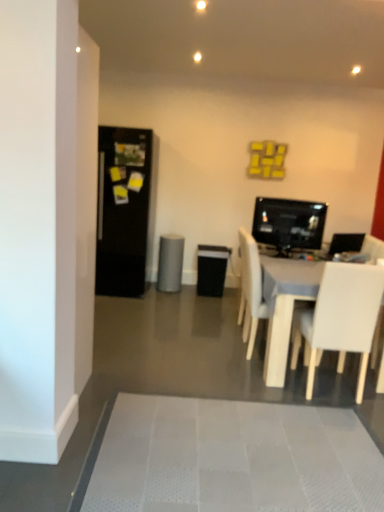
Question: Is gray matte speaker at center wider than white matte chair at center, the second chair viewed from the front?

Choices:
 (A) no
 (B) yes

Answer: (A)

Question: Is gray matte speaker at center not within white matte chair at center, the first chair when ordered from back to front?

Choices:
 (A) yes
 (B) no

Answer: (A)

Question: Is gray matte speaker at center at the right side of white matte chair at center, the second chair viewed from the front?

Choices:
 (A) no
 (B) yes

Answer: (A)

Question: Is the position of gray matte speaker at center less distant than that of white matte chair at center, the second chair viewed from the front?

Choices:
 (A) yes
 (B) no

Answer: (B)

Question: From the image's perspective, is gray matte speaker at center beneath white matte chair at center, the first chair when ordered from back to front?

Choices:
 (A) no
 (B) yes

Answer: (A)

Question: From a real-world perspective, is gray matte speaker at center physically below white matte chair at center, the second chair viewed from the front?

Choices:
 (A) no
 (B) yes

Answer: (B)

Question: Is black matte refrigerator at left behind white textured bath mat at lower center?

Choices:
 (A) yes
 (B) no

Answer: (A)

Question: Does black matte refrigerator at left have a smaller size compared to white textured bath mat at lower center?

Choices:
 (A) yes
 (B) no

Answer: (B)

Question: Does black matte refrigerator at left appear on the right side of white textured bath mat at lower center?

Choices:
 (A) yes
 (B) no

Answer: (B)

Question: Is black matte refrigerator at left directly adjacent to white textured bath mat at lower center?

Choices:
 (A) yes
 (B) no

Answer: (B)

Question: Is black matte refrigerator at left not near white textured bath mat at lower center?

Choices:
 (A) no
 (B) yes

Answer: (B)

Question: Is white textured bath mat at lower center at the back of black matte refrigerator at left?

Choices:
 (A) no
 (B) yes

Answer: (A)

Question: Is gray matte speaker at center taller than white textured bath mat at lower center?

Choices:
 (A) no
 (B) yes

Answer: (B)